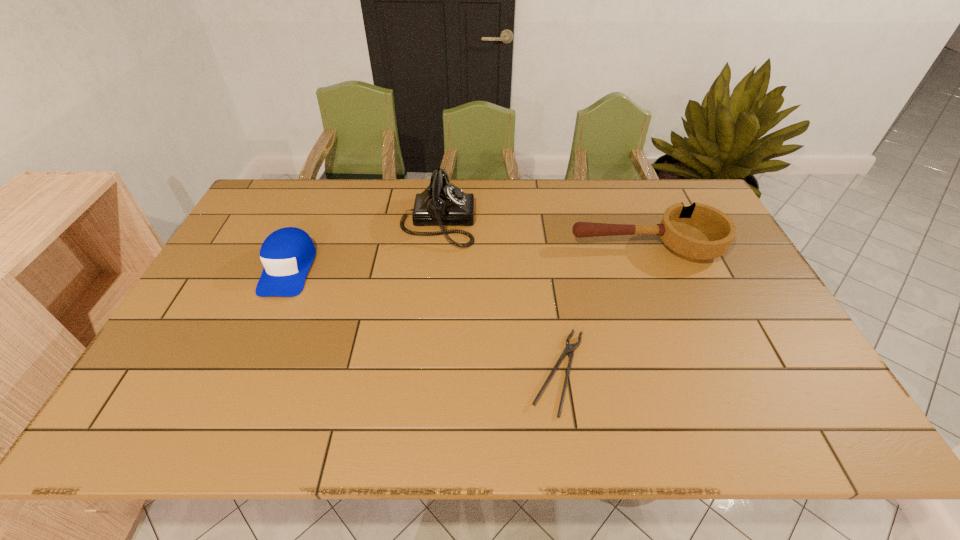
Find the location of a particular element. The width and height of the screenshot is (960, 540). free point between the rightmost object and the telephone is located at coordinates [x=541, y=234].

The height and width of the screenshot is (540, 960). I want to click on object identified as the closest to the leftmost object, so point(441,203).

At what (x,y) coordinates should I click in order to perform the action: click on object that ranks as the third closest to the third object from left to right. Please return your answer as a coordinate pair (x, y). The width and height of the screenshot is (960, 540). Looking at the image, I should click on (287, 254).

Identify the location of vacant space that satisfies the following two spatial constraints: 1. on the dial of the tallest object; 2. on the left side of the shortest object. This screenshot has height=540, width=960. (421, 373).

This screenshot has height=540, width=960. In order to click on free region that satisfies the following two spatial constraints: 1. on the dial of the second object from left to right; 2. on the front-facing side of the baseball cap in this screenshot , I will do `click(433, 268)`.

What are the coordinates of `vacant area that satisfies the following two spatial constraints: 1. on the dial of the tallest object; 2. with the handle on the side of the rightmost object` in the screenshot? It's located at pos(435,246).

You are a GUI agent. You are given a task and a screenshot of the screen. Output one action in this format:
    pyautogui.click(x=<x>, y=<y>)
    Task: Click on the free point that satisfies the following two spatial constraints: 1. on the front-facing side of the baseball cap; 2. on the right side of the third object from left to right
    Image resolution: width=960 pixels, height=540 pixels.
    Given the screenshot: What is the action you would take?
    pyautogui.click(x=243, y=373)

At what (x,y) coordinates should I click in order to perform the action: click on vacant position in the image that satisfies the following two spatial constraints: 1. with the handle on the side of the rightmost object; 2. on the dial of the third object from right to left. Please return your answer as a coordinate pair (x, y). Looking at the image, I should click on (636, 222).

You are a GUI agent. You are given a task and a screenshot of the screen. Output one action in this format:
    pyautogui.click(x=<x>, y=<y>)
    Task: Click on the free location that satisfies the following two spatial constraints: 1. on the front-facing side of the baseball cap; 2. on the left side of the nearest object
    
    Given the screenshot: What is the action you would take?
    pyautogui.click(x=243, y=373)

I want to click on vacant space that satisfies the following two spatial constraints: 1. on the front-facing side of the nearest object; 2. on the left side of the leftmost object, so click(243, 373).